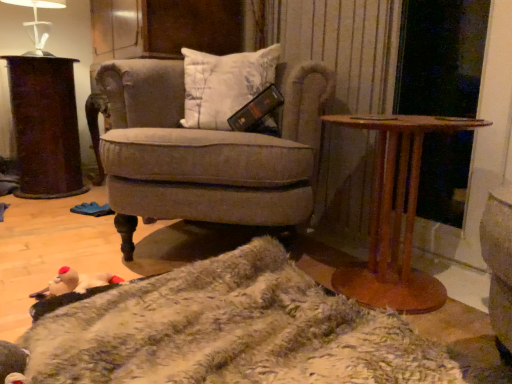
Question: Is white cotton pillow at center at the back of dark brown polished wood desk at left?

Choices:
 (A) yes
 (B) no

Answer: (B)

Question: From the image's perspective, is dark brown polished wood desk at left below white cotton pillow at center?

Choices:
 (A) yes
 (B) no

Answer: (A)

Question: From a real-world perspective, is dark brown polished wood desk at left physically above white cotton pillow at center?

Choices:
 (A) no
 (B) yes

Answer: (A)

Question: Is dark brown polished wood desk at left to the left of white cotton pillow at center from the viewer's perspective?

Choices:
 (A) no
 (B) yes

Answer: (B)

Question: Considering the relative sizes of dark brown polished wood desk at left and white cotton pillow at center in the image provided, is dark brown polished wood desk at left thinner than white cotton pillow at center?

Choices:
 (A) no
 (B) yes

Answer: (A)

Question: Does dark brown polished wood desk at left have a larger size compared to white cotton pillow at center?

Choices:
 (A) no
 (B) yes

Answer: (B)

Question: From the image's perspective, is velvet beige armchair at center over fuzzy beige blanket at lower center?

Choices:
 (A) no
 (B) yes

Answer: (B)

Question: Does velvet beige armchair at center come in front of fuzzy beige blanket at lower center?

Choices:
 (A) yes
 (B) no

Answer: (B)

Question: Is velvet beige armchair at center at the left side of fuzzy beige blanket at lower center?

Choices:
 (A) no
 (B) yes

Answer: (B)

Question: From a real-world perspective, is velvet beige armchair at center located beneath fuzzy beige blanket at lower center?

Choices:
 (A) yes
 (B) no

Answer: (B)

Question: Is velvet beige armchair at center looking in the opposite direction of fuzzy beige blanket at lower center?

Choices:
 (A) no
 (B) yes

Answer: (A)

Question: Is velvet beige armchair at center not near fuzzy beige blanket at lower center?

Choices:
 (A) no
 (B) yes

Answer: (A)

Question: Is dark brown polished wood desk at left shorter than white glossy table lamp at upper left?

Choices:
 (A) no
 (B) yes

Answer: (A)